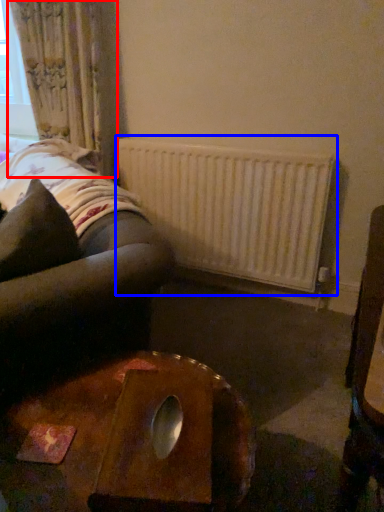
Question: Which of the following is the closest to the observer, curtain (highlighted by a red box) or radiator (highlighted by a blue box)?

Choices:
 (A) curtain
 (B) radiator

Answer: (B)